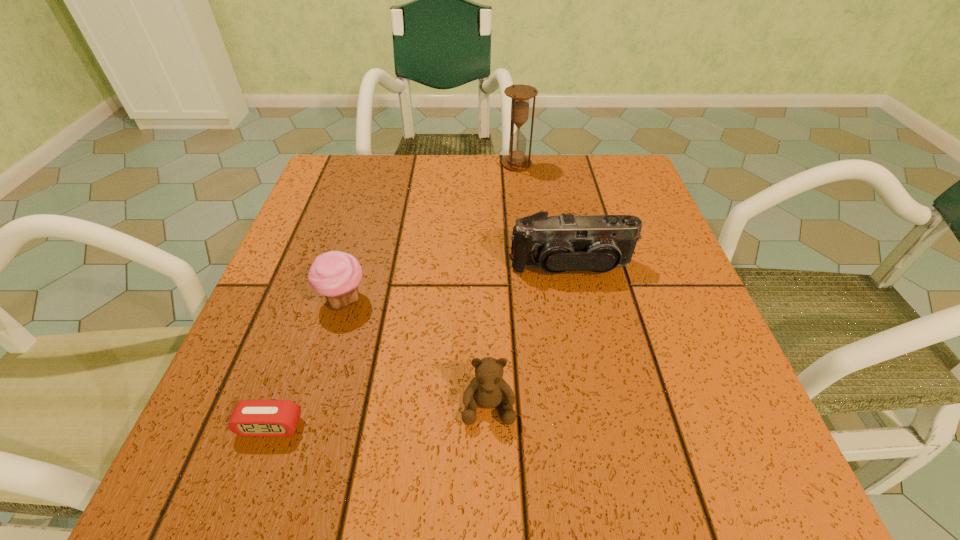
Identify the location of object at the near edge. The height and width of the screenshot is (540, 960). (255, 418).

I want to click on cupcake present at the left edge, so click(336, 275).

Locate an element on the screen. This screenshot has width=960, height=540. alarm clock at the left edge is located at coordinates (255, 418).

Locate an element on the screen. object situated at the right edge is located at coordinates (597, 243).

Where is `object that is at the near left corner`? object that is at the near left corner is located at coordinates (255, 418).

Locate an element on the screen. blank space at the far edge of the desktop is located at coordinates (516, 197).

In the image, there is a desktop. Find the location of `vacant space at the near edge`. vacant space at the near edge is located at coordinates (637, 473).

Identify the location of free space at the left edge of the desktop. (275, 274).

Locate an element on the screen. vacant region at the right edge of the desktop is located at coordinates (652, 356).

In the image, there is a desktop. Where is `vacant space at the far left corner`? vacant space at the far left corner is located at coordinates (354, 200).